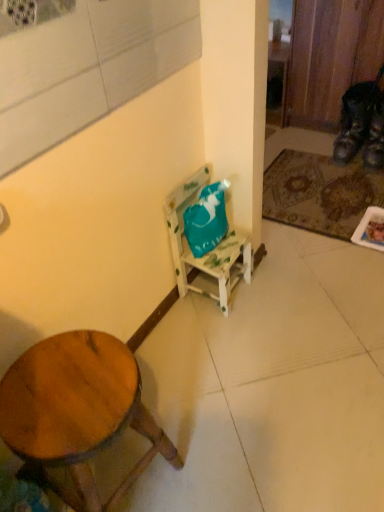
Question: Is leather brown shoe at lower right, acting as the 1th shoe starting from the left, far from wooden stool at lower left?

Choices:
 (A) no
 (B) yes

Answer: (B)

Question: Is leather brown shoe at lower right, acting as the 1th shoe starting from the left, behind wooden stool at lower left?

Choices:
 (A) no
 (B) yes

Answer: (B)

Question: Is leather brown shoe at lower right, marked as the second shoe in a right-to-left arrangement, bigger than wooden stool at lower left?

Choices:
 (A) yes
 (B) no

Answer: (B)

Question: Is leather brown shoe at lower right, marked as the second shoe in a right-to-left arrangement, located outside wooden stool at lower left?

Choices:
 (A) yes
 (B) no

Answer: (A)

Question: From a real-world perspective, is leather brown shoe at lower right, acting as the 1th shoe starting from the left, located beneath wooden stool at lower left?

Choices:
 (A) yes
 (B) no

Answer: (A)

Question: Considering the positions of leather at right, placed as the 1th shoe when sorted from right to left, and brown textured mat at lower right in the image, is leather at right, placed as the 1th shoe when sorted from right to left, taller or shorter than brown textured mat at lower right?

Choices:
 (A) tall
 (B) short

Answer: (A)

Question: Looking at their shapes, would you say leather at right, which ranks as the second shoe in left-to-right order, is wider or thinner than brown textured mat at lower right?

Choices:
 (A) thin
 (B) wide

Answer: (A)

Question: In the image, is leather at right, which ranks as the second shoe in left-to-right order, positioned in front of or behind brown textured mat at lower right?

Choices:
 (A) behind
 (B) front

Answer: (A)

Question: Considering the positions of point (380, 121) and point (352, 180), is point (380, 121) closer or farther from the camera than point (352, 180)?

Choices:
 (A) farther
 (B) closer

Answer: (B)

Question: Considering the positions of wooden stool at lower left and leather brown shoe at lower right, marked as the second shoe in a right-to-left arrangement, in the image, is wooden stool at lower left taller or shorter than leather brown shoe at lower right, marked as the second shoe in a right-to-left arrangement,?

Choices:
 (A) tall
 (B) short

Answer: (A)

Question: From a real-world perspective, relative to leather brown shoe at lower right, marked as the second shoe in a right-to-left arrangement, is wooden stool at lower left vertically above or below?

Choices:
 (A) above
 (B) below

Answer: (A)

Question: From the image's perspective, is wooden stool at lower left located above or below leather brown shoe at lower right, marked as the second shoe in a right-to-left arrangement?

Choices:
 (A) above
 (B) below

Answer: (B)

Question: Is wooden stool at lower left wider or thinner than leather brown shoe at lower right, marked as the second shoe in a right-to-left arrangement?

Choices:
 (A) thin
 (B) wide

Answer: (B)

Question: Looking at the image, does wooden stool at lower left seem bigger or smaller compared to brown textured mat at lower right?

Choices:
 (A) big
 (B) small

Answer: (A)

Question: From the image's perspective, is wooden stool at lower left above or below brown textured mat at lower right?

Choices:
 (A) below
 (B) above

Answer: (A)